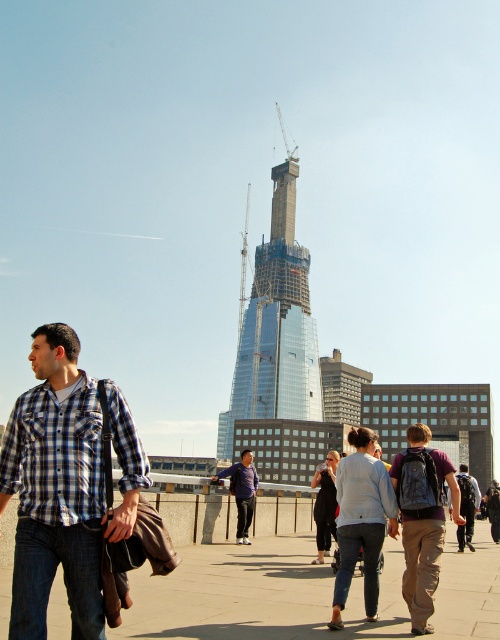
You are a city planner analyzing this urban scene. Considering the scale of the glassy steel tower at center and the plaid cotton shirt at left, which object would cast a longer shadow during midday? Explain your reasoning based on their sizes and positions.

The glassy steel tower at center would cast a longer shadow than the plaid cotton shirt at left because it is larger in size and positioned further away from the camera, resulting in a greater shadow length during midday.

You are a photographer standing on the walkway. You want to take a photo of the plaid cotton shirt at left and dark gray backpack at center. Which object should you adjust your camera to focus on first if you want to capture both in the same frame?

The plaid cotton shirt at left is to the left of the dark gray backpack at center, so you should focus on the plaid cotton shirt at left first to ensure both are in the frame.

You are a photographer standing in the urban scene. You want to capture a photo of the glassy steel tower at center without any people blocking it. Is the light blue sweater at center in a position that would block your view of the tower?

The glassy steel tower at center is positioned over the light blue sweater at center, so the light blue sweater at center is directly in front of the tower. This means the sweater would block your view of the tower unless you move to a different angle or position.